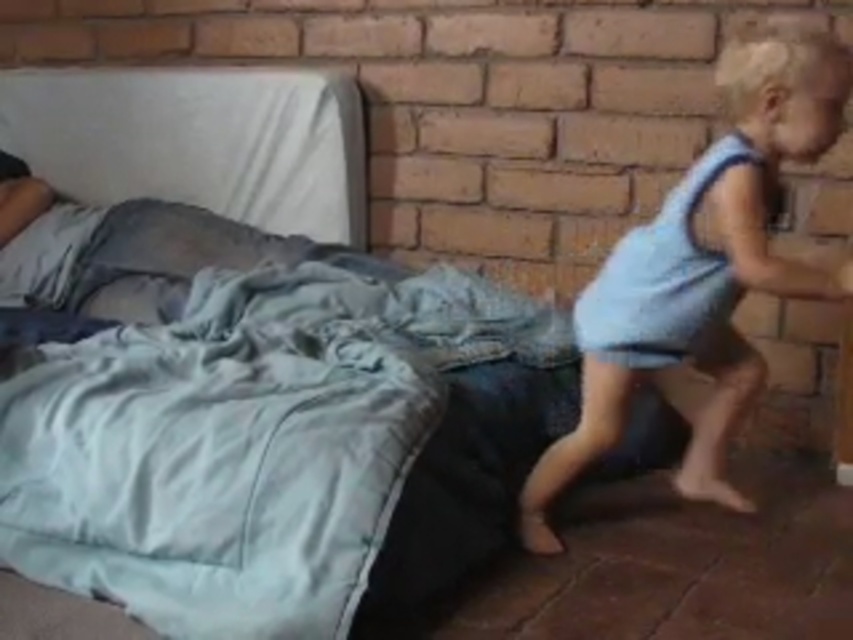
You are a parent trying to decide where to place a new toy. The toy needs to be placed between the silky blue blanket at center and the light blue fabric at right. Given that the toy is 30 cm wide, can it fit in the space between them?

The silky blue blanket at center is to the left of light blue fabric at right. The distance between them is not specified, so it is impossible to determine if the 30 cm wide toy can fit without more information.

You are a parent trying to decide where to place a new toy. You have a silky blue blanket at center and a light blue fabric at right. Which object is positioned higher in the image?

The silky blue blanket at center is located above the light blue fabric at right, so it is positioned higher.